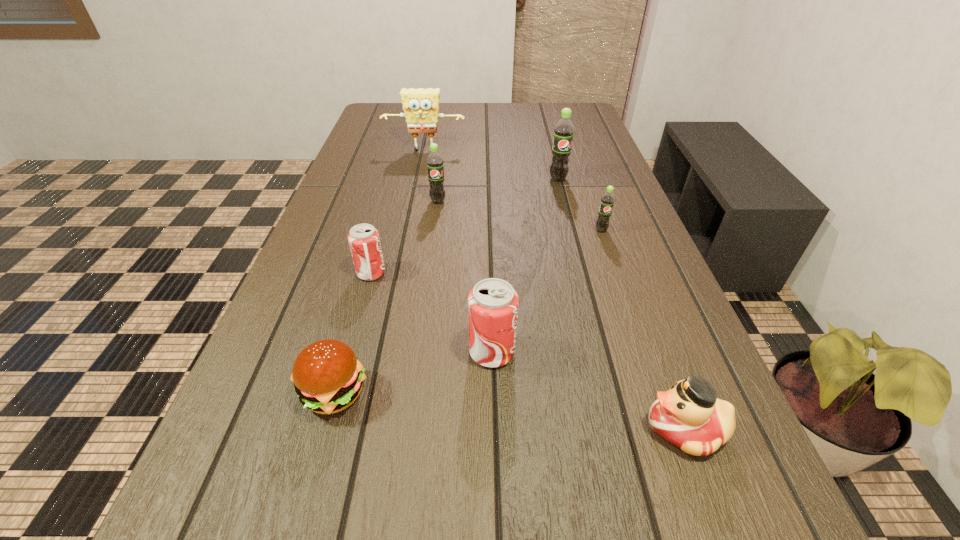
At what (x,y) coordinates should I click in order to perform the action: click on vacant point located on the face of the duck. Please return your answer as a coordinate pair (x, y). Looking at the image, I should click on (427, 428).

In order to click on free space located 0.090m on the face of the duck in this screenshot , I will do (x=586, y=428).

This screenshot has height=540, width=960. I want to click on free location located 0.300m on the face of the duck, so [x=446, y=428].

The height and width of the screenshot is (540, 960). I want to click on vacant region located on the back of the hamburger, so click(372, 260).

I want to click on sponge at the left edge, so click(x=421, y=106).

Image resolution: width=960 pixels, height=540 pixels. In order to click on soda can that is at the left edge in this screenshot , I will do `click(364, 242)`.

Identify the location of hamburger that is at the left edge. The width and height of the screenshot is (960, 540). (327, 376).

Locate an element on the screen. Image resolution: width=960 pixels, height=540 pixels. duck positioned at the right edge is located at coordinates (689, 415).

I want to click on free location at the far edge of the desktop, so click(456, 104).

Find the location of `vacant region at the left edge of the desktop`. vacant region at the left edge of the desktop is located at coordinates (220, 470).